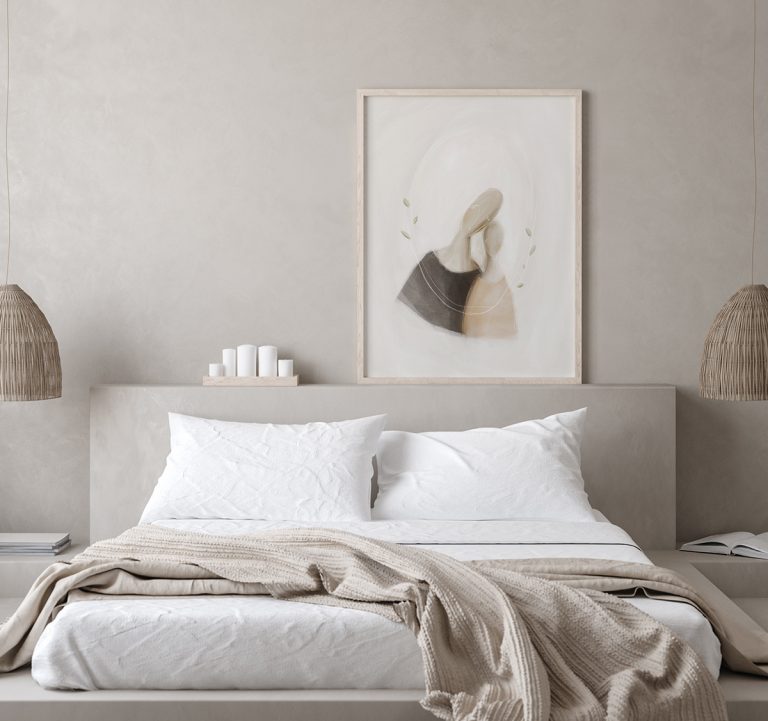
Find the location of a particular element. The image size is (768, 721). blanket is located at coordinates (359, 564).